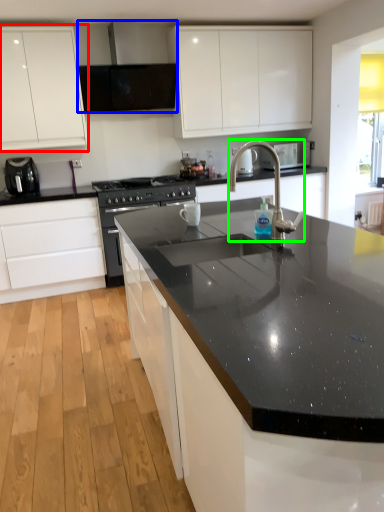
Question: Based on their relative distances, which object is farther from cabinetry (highlighted by a red box)? Choose from exhaust hood (highlighted by a blue box) and tap (highlighted by a green box).

Choices:
 (A) exhaust hood
 (B) tap

Answer: (B)